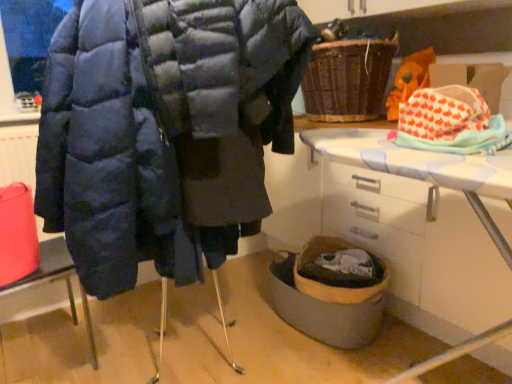
Identify the location of unoccupied region to the right of matte black coat at left. This screenshot has height=384, width=512. (134, 344).